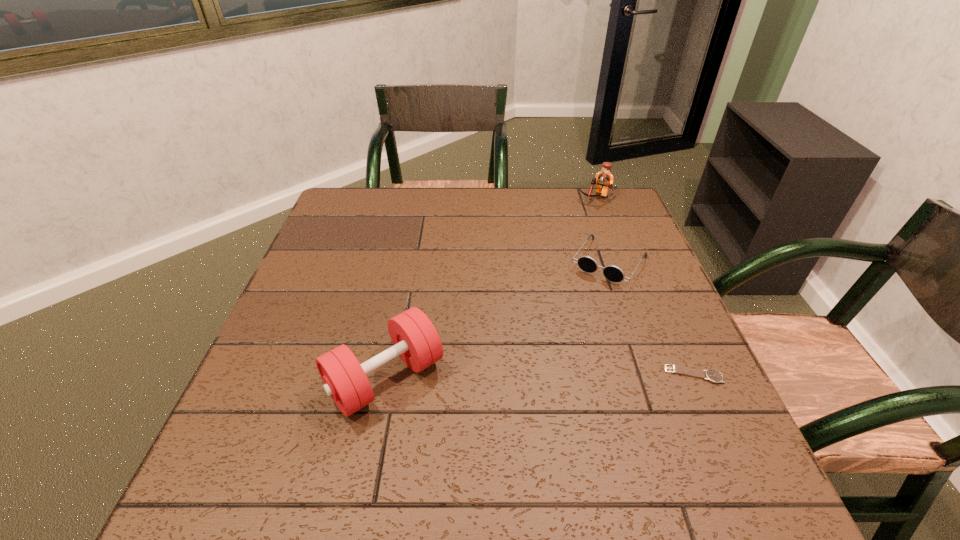
The height and width of the screenshot is (540, 960). Identify the location of free space on the desktop that is between the leftmost object and the watch and is positioned on the front-facing side of the second farthest object. (532, 376).

At what (x,y) coordinates should I click in order to perform the action: click on vacant space on the desktop that is between the dumbbell and the watch and is positioned holding a crossbow in the hands of the Lego. Please return your answer as a coordinate pair (x, y). This screenshot has width=960, height=540. Looking at the image, I should click on (507, 376).